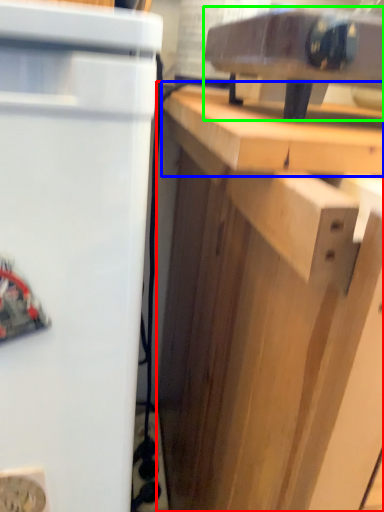
Question: Which is nearer to the cabinetry (highlighted by a red box)? counter top (highlighted by a blue box) or appliance (highlighted by a green box).

Choices:
 (A) counter top
 (B) appliance

Answer: (A)